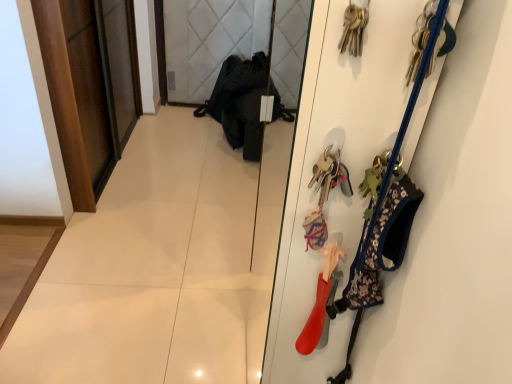
Locate an element on the screen. The width and height of the screenshot is (512, 384). vacant area that lies between dark wood door at left and clear glass mirror at center is located at coordinates (193, 195).